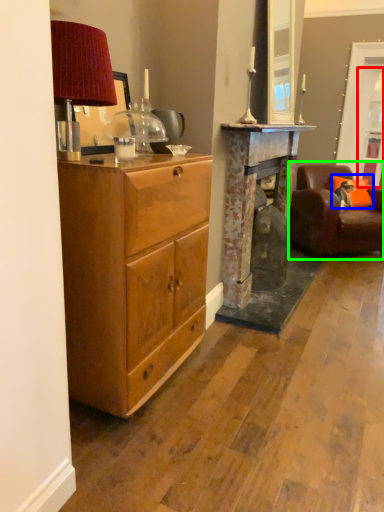
Question: Based on their relative distances, which object is nearer to glass door (highlighted by a red box)? Choose from pillow (highlighted by a blue box) and chair (highlighted by a green box).

Choices:
 (A) pillow
 (B) chair

Answer: (A)